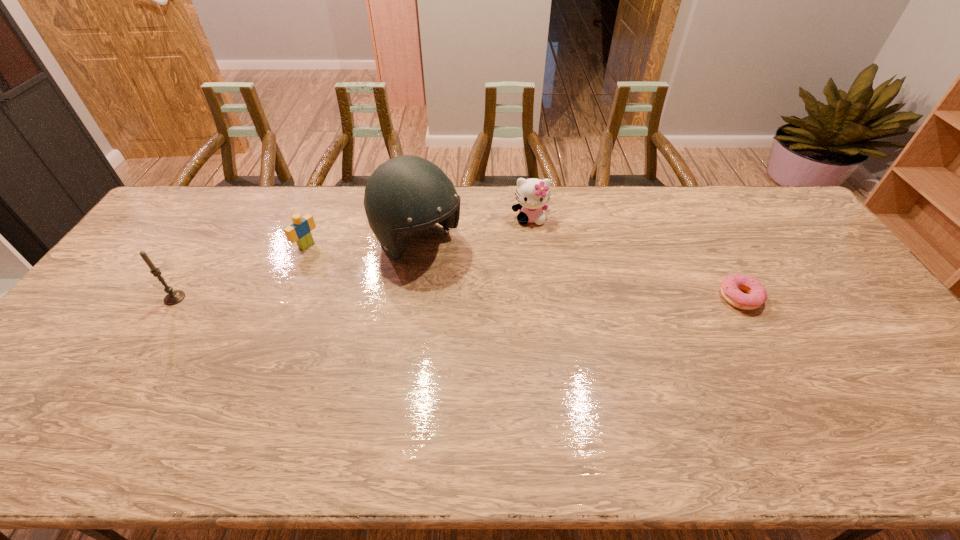
Image resolution: width=960 pixels, height=540 pixels. In order to click on free spot between the tallest object and the leftmost object in this screenshot , I will do `click(297, 271)`.

Where is `vacant space that's between the Lego and the shortest object`? This screenshot has width=960, height=540. vacant space that's between the Lego and the shortest object is located at coordinates (523, 271).

Find the location of a particular element. Image resolution: width=960 pixels, height=540 pixels. empty space that is in between the third object from left to right and the second object from left to right is located at coordinates (362, 244).

Locate an element on the screen. unoccupied area between the leftmost object and the Lego is located at coordinates (241, 272).

Where is `blank region between the shortest object and the candle`? This screenshot has height=540, width=960. blank region between the shortest object and the candle is located at coordinates pos(457,298).

I want to click on free spot between the fourth object from right to left and the leftmost object, so click(241, 272).

Find the location of a particular element. free space between the candle and the doughnut is located at coordinates (457, 298).

Identify the location of object that is the second closest one to the third shortest object. The image size is (960, 540). (730, 287).

You are a GUI agent. You are given a task and a screenshot of the screen. Output one action in this format:
    pyautogui.click(x=<x>, y=<y>)
    Task: Click on the closest object to the shortest object
    
    Given the screenshot: What is the action you would take?
    pyautogui.click(x=532, y=194)

Locate an element on the screen. The image size is (960, 540). vacant region that satisfies the following two spatial constraints: 1. on the back side of the leftmost object; 2. on the left side of the second object from right to left is located at coordinates (226, 218).